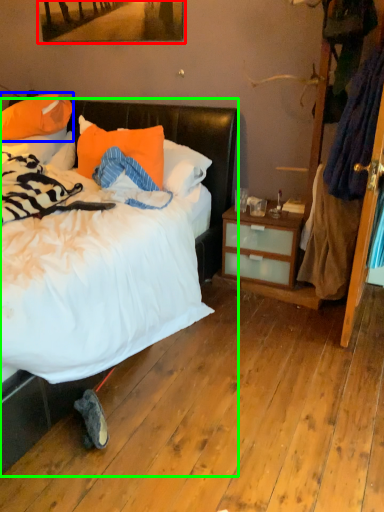
Question: Based on their relative distances, which object is farther from picture frame (highlighted by a red box)? Choose from pillow (highlighted by a blue box) and bed (highlighted by a green box).

Choices:
 (A) pillow
 (B) bed

Answer: (A)